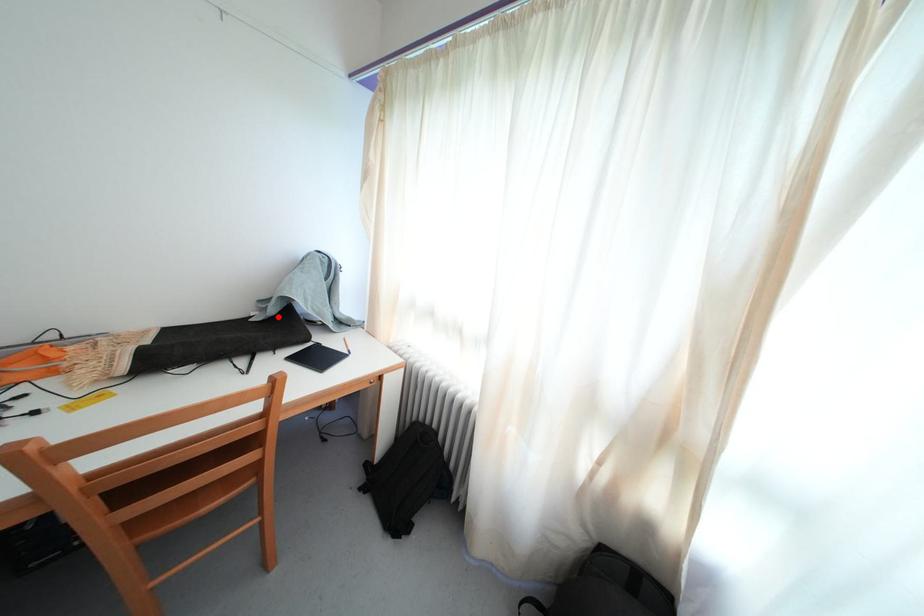
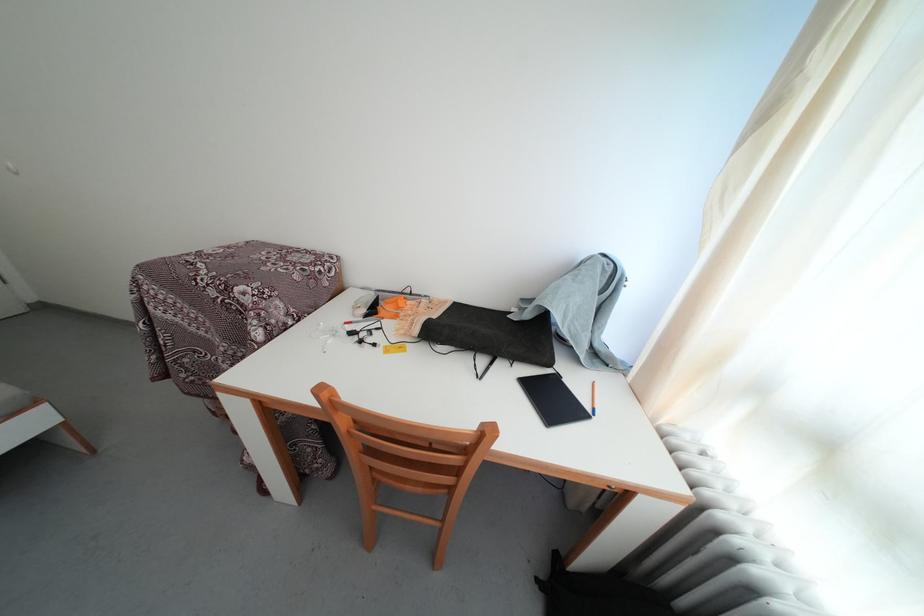
Question: A red point is marked in image1. In image2, is the corresponding 3D point closer to the camera or farther? Reply with the corresponding letter.

Choices:
 (A) The corresponding 3D point is closer.
 (B) The corresponding 3D point is farther.

Answer: (A)